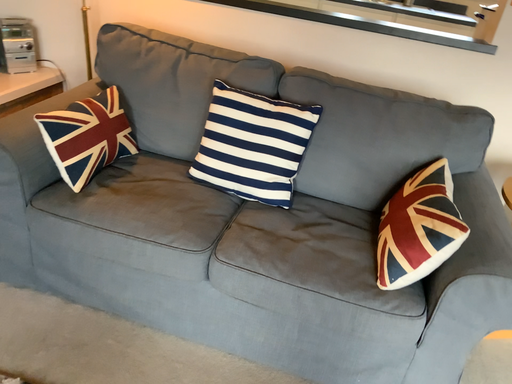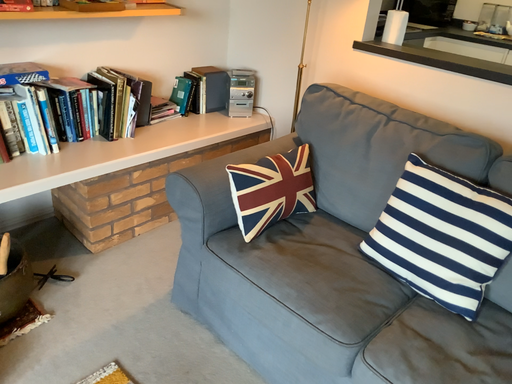
Question: Which way did the camera rotate in the video?

Choices:
 (A) rotated left
 (B) rotated right

Answer: (A)